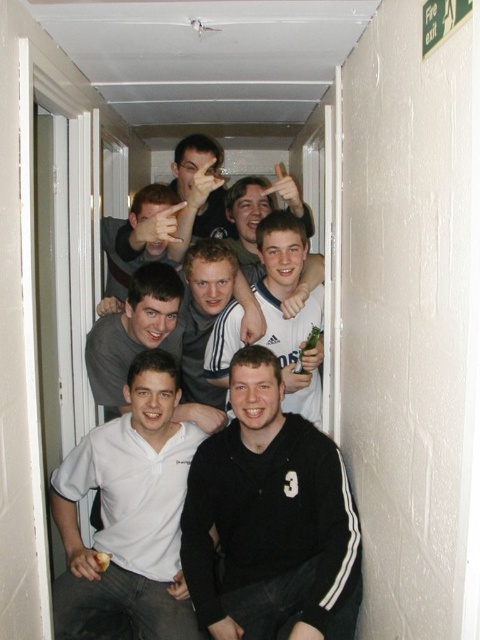
You are a photographer trying to capture a clear shot of the white matte polo shirt at lower left and the white matte shirt at center. Since both are white, you want to ensure that the one in front doesn not block the other too much. Which shirt should you focus on to make sure the other is visible behind it?

The white matte polo shirt at lower left is in front of the white matte shirt at center. To ensure the white matte shirt at center is visible behind, focus on the white matte polo shirt at lower left and position yourself so that the background shirt is partially visible through any gaps or by adjusting the angle.

Consider the image. You are a photographer trying to capture a group photo of the seven young men in the hallway. You want to ensure that the white matte polo shirt at lower left and the white matte shirt at center are both clearly visible in the frame. Given their current positions, is there enough space between them to fit both into the photo without overlapping?

The white matte polo shirt at lower left is 21.97 inches away from the white matte shirt at center. Since the distance between them is over 20 inches, there should be sufficient space to capture both in the frame without overlapping, provided the camera lens can accommodate this distance within the shot.